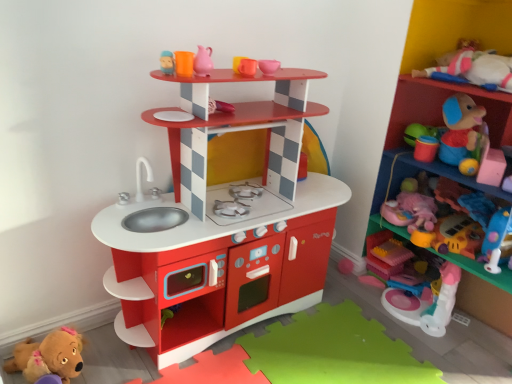
Question: Considering the positions of point (62, 349) and point (408, 82), is point (62, 349) closer or farther from the camera than point (408, 82)?

Choices:
 (A) farther
 (B) closer

Answer: (B)

Question: From their relative heights in the image, would you say brown plush toy at lower left, which ranks as the first toy in bottom-to-top order, is taller or shorter than plastic toy at upper right, the 1th shelf positioned from the right?

Choices:
 (A) tall
 (B) short

Answer: (B)

Question: Which object is positioned closest to the pink plastic toy at right, the 2th toy ordered from the bottom?

Choices:
 (A) translucent pink plastic blocks at lower right, positioned as the third toy in bottom-to-top order
 (B) matte plastic shelf at upper center, which is counted as the first shelf, starting from the left
 (C) brown plush toy at lower left, placed as the 5th toy when sorted from top to bottom
 (D) pink plush toy at right, positioned as the second toy in top-to-bottom order
 (E) plastic toy at upper right, the 2th shelf viewed from the left

Answer: (A)

Question: Which object is the farthest from the matte plastic shelf at upper center, which is counted as the first shelf, starting from the left?

Choices:
 (A) translucent pink plastic blocks at lower right, which is the 2th toy in right-to-left order
 (B) brown plush toy at lower left, placed as the 5th toy when sorted from right to left
 (C) pink plush toy at right, acting as the 1th toy starting from the right
 (D) pink plastic toy at right, the 3th toy positioned from the left
 (E) plastic toy at upper right, the 2th shelf viewed from the left

Answer: (A)